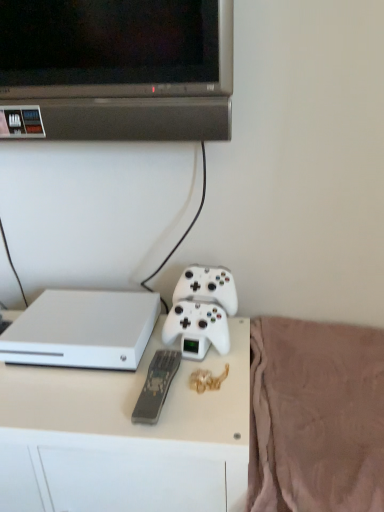
Locate an element on the screen. free space in front of white matte game controller at center is located at coordinates (200, 387).